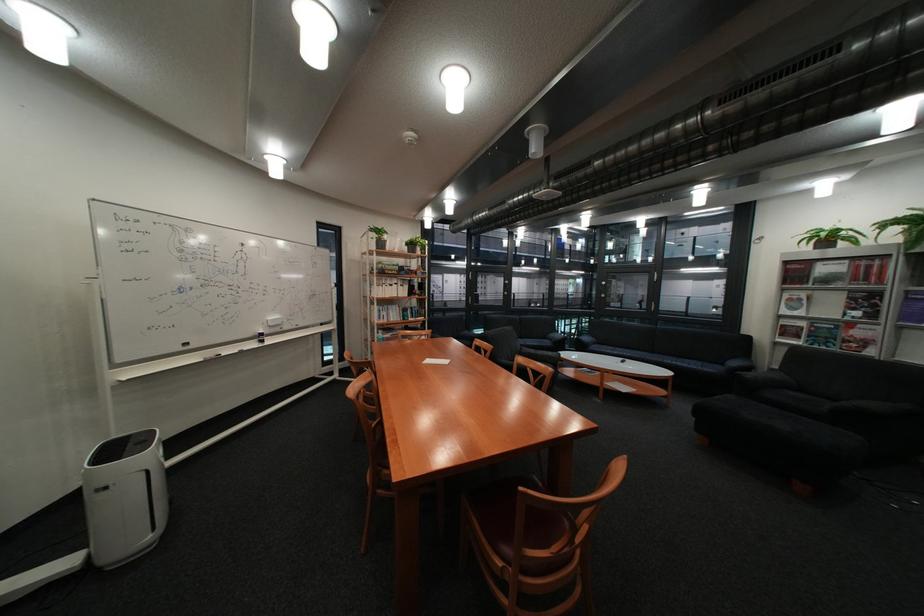
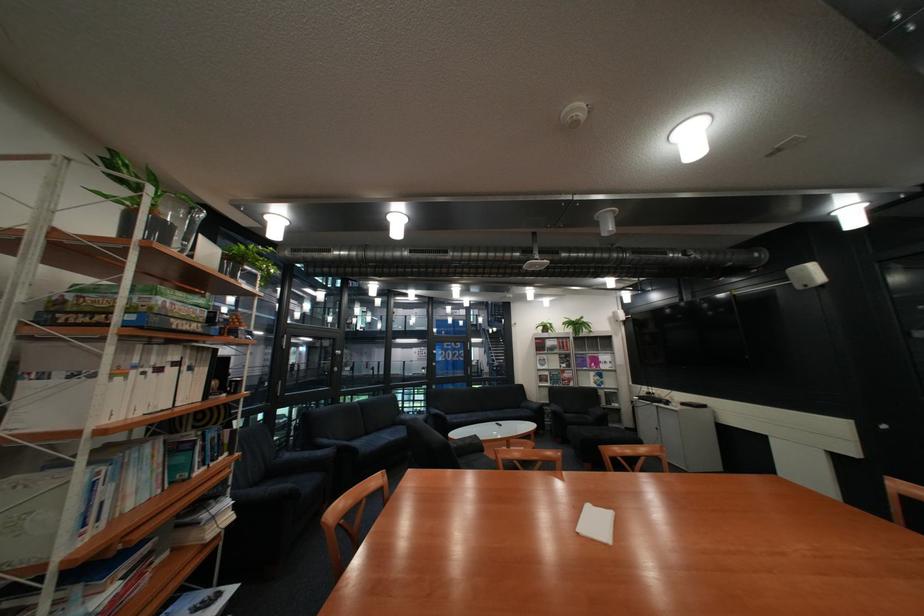
The point at (x=395, y=286) is marked in the first image. Where is the corresponding point in the second image?

(134, 379)